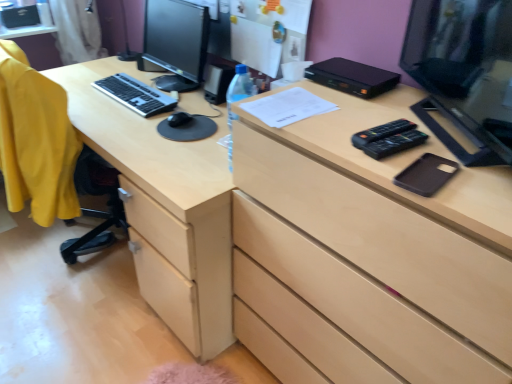
The width and height of the screenshot is (512, 384). In order to click on free area in between black glossy monitor at upper right, which ranks as the 1th computer monitor in right-to-left order, and white paper at center in this screenshot , I will do `click(368, 125)`.